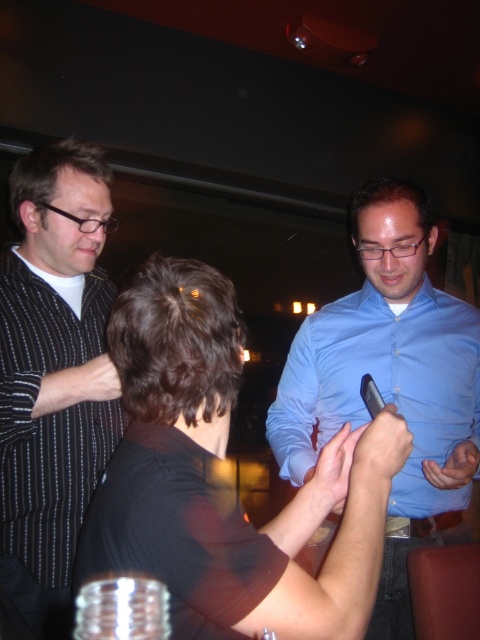
Between point (16, 557) and point (286, 381), which one is positioned behind?

Point (286, 381)

Which is more to the left, black striped shirt at left or blue shirt at center?

black striped shirt at left is more to the left.

Is point (67, 140) positioned behind point (453, 438)?

Yes.

Image resolution: width=480 pixels, height=640 pixels. In order to click on black striped shirt at left in this screenshot , I will do `click(52, 374)`.

Is black matte shirt at center positioned before black striped shirt at left?

Yes, black matte shirt at center is in front of black striped shirt at left.

Does point (311, 593) lie in front of point (54, 348)?

That is True.

Identify the location of black matte shirt at center. Image resolution: width=480 pixels, height=640 pixels. (214, 486).

Is point (297, 499) behind point (406, 228)?

No, (297, 499) is closer to viewer.

Is black matte shirt at center positioned before blue shirt at center?

Yes, it is in front of blue shirt at center.

Identify the location of black matte shirt at center. The height and width of the screenshot is (640, 480). (214, 486).